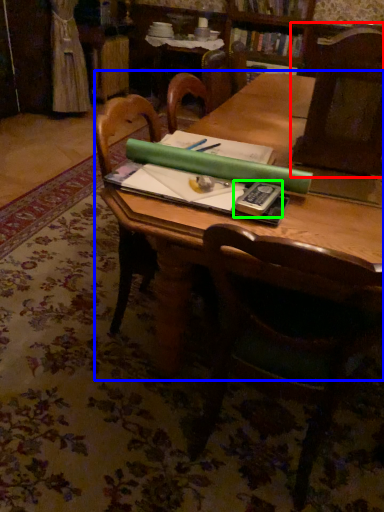
Question: Estimate the real-world distances between objects in this image. Which object is closer to chair (highlighted by a red box), table (highlighted by a blue box) or paperback book (highlighted by a green box)?

Choices:
 (A) table
 (B) paperback book

Answer: (A)